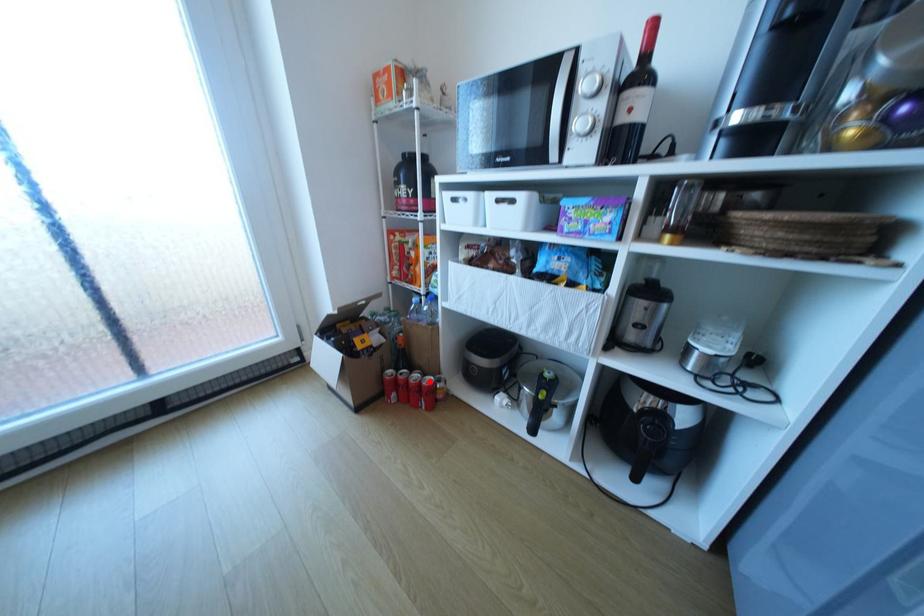
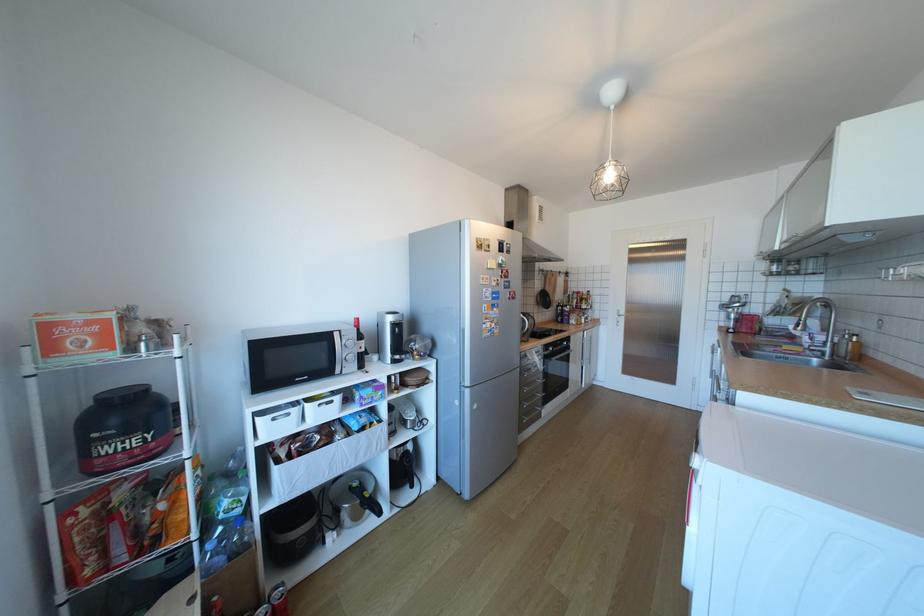
Question: I am providing you with two images of the same scene from different viewpoints. Given a red point in image1, look at the same physical point in image2. Is it:

Choices:
 (A) Closer to the viewpoint
 (B) Farther from the viewpoint

Answer: (A)